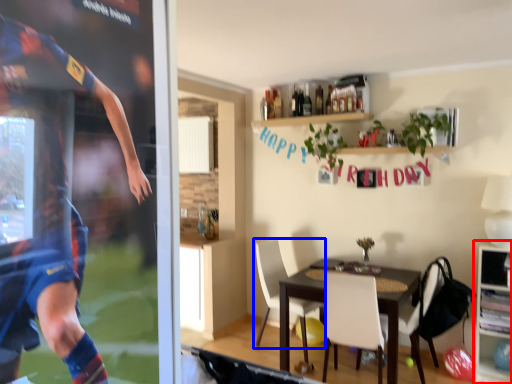
Question: Which point is further to the camera, cabinetry (highlighted by a red box) or chair (highlighted by a blue box)?

Choices:
 (A) cabinetry
 (B) chair

Answer: (B)